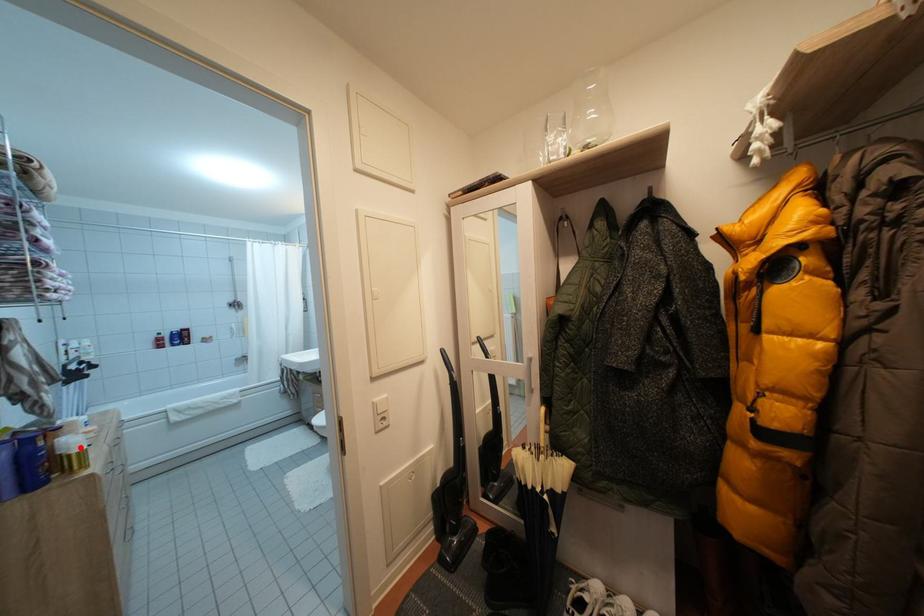
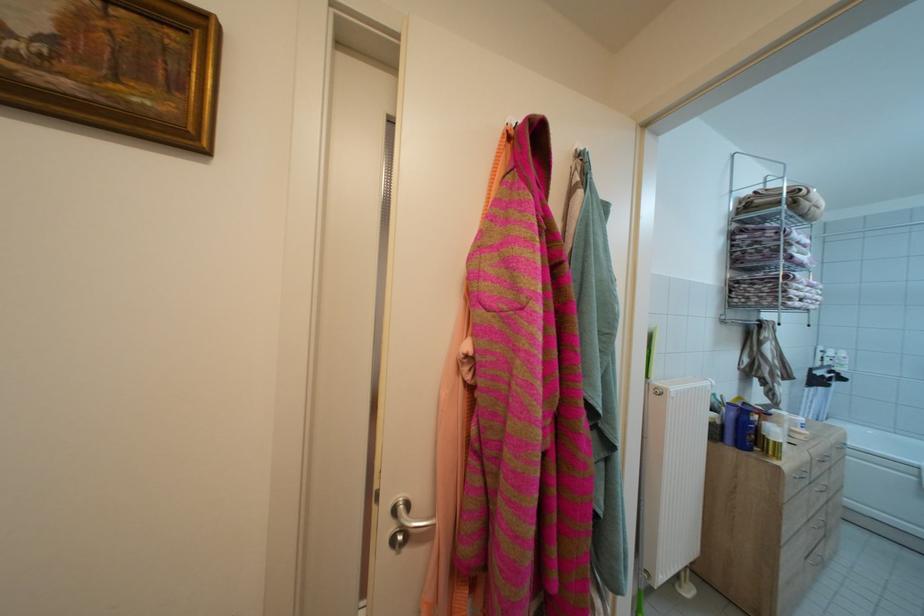
Locate, in the second image, the point that corresponds to the highlighted location in the first image.

(781, 437)